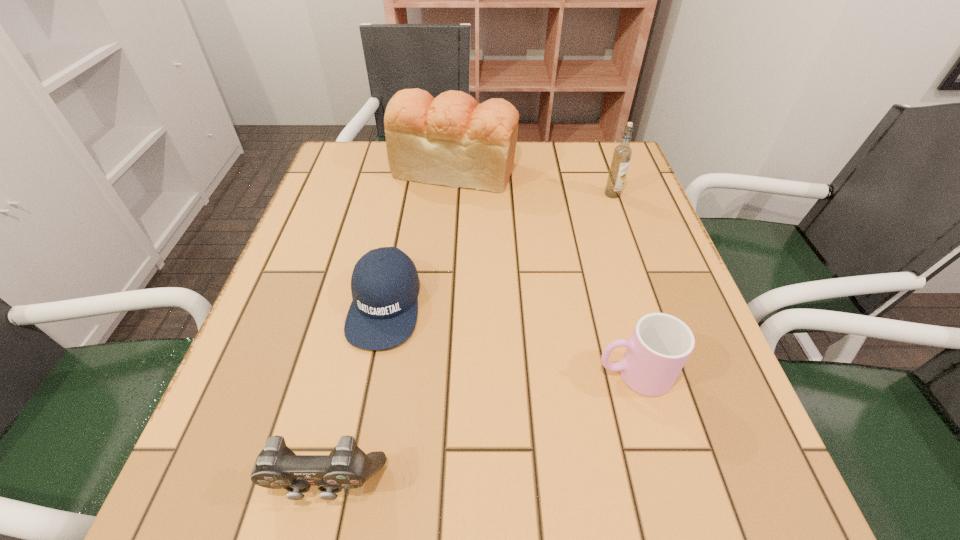
Locate an element on the screen. Image resolution: width=960 pixels, height=540 pixels. bread is located at coordinates (452, 140).

The height and width of the screenshot is (540, 960). Find the location of `vodka`. vodka is located at coordinates (622, 153).

Where is `cup`? The width and height of the screenshot is (960, 540). cup is located at coordinates (660, 345).

Find the location of a particular element. This screenshot has width=960, height=540. the nearest object is located at coordinates (277, 467).

You are a GUI agent. You are given a task and a screenshot of the screen. Output one action in this format:
    pyautogui.click(x=<x>, y=<y>)
    Task: Click on the third farthest object
    Image resolution: width=960 pixels, height=540 pixels.
    Given the screenshot: What is the action you would take?
    pyautogui.click(x=383, y=313)

Find the location of `baseball cap`. baseball cap is located at coordinates (383, 313).

Identify the location of free space located on the left of the bread. This screenshot has width=960, height=540. (349, 169).

Identify the location of free space located 0.360m on the label of the vodka. The width and height of the screenshot is (960, 540). (653, 307).

Where is `free location located with the handle on the side of the fourth farthest object`? free location located with the handle on the side of the fourth farthest object is located at coordinates (458, 374).

Where is `vacant space situated with the handle on the side of the fourth farthest object`? vacant space situated with the handle on the side of the fourth farthest object is located at coordinates (412, 374).